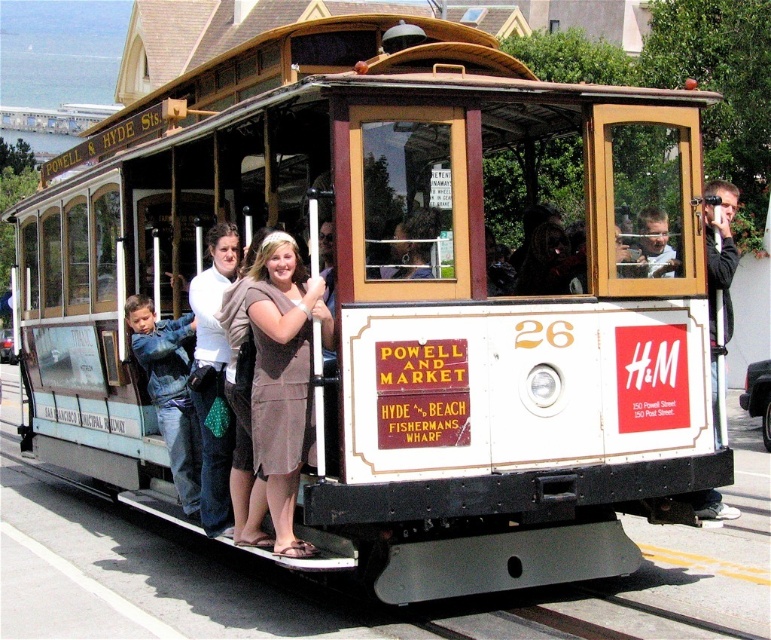
Which of these two, metallic silver camera at right or matte black camera at center, stands taller?

metallic silver camera at right

Which of these two, metallic silver camera at right or matte black camera at center, stands shorter?

matte black camera at center is shorter.

I want to click on metallic silver camera at right, so click(x=719, y=253).

Locate an element on the screen. metallic silver camera at right is located at coordinates (719, 253).

In the scene shown: Can you confirm if matte brown dress at center is shorter than matte black camera at center?

No, matte brown dress at center is not shorter than matte black camera at center.

Between matte brown dress at center and matte black camera at center, which one has more height?

With more height is matte brown dress at center.

Find the location of `matte brown dress at center`. matte brown dress at center is located at coordinates (275, 385).

Is matte brown dress at center thinner than metallic silver camera at right?

Incorrect, matte brown dress at center's width is not less than metallic silver camera at right's.

Is matte brown dress at center further to the viewer compared to metallic silver camera at right?

No, matte brown dress at center is in front of metallic silver camera at right.

This screenshot has height=640, width=771. What do you see at coordinates (275, 385) in the screenshot? I see `matte brown dress at center` at bounding box center [275, 385].

Identify the location of matte brown dress at center. (275, 385).